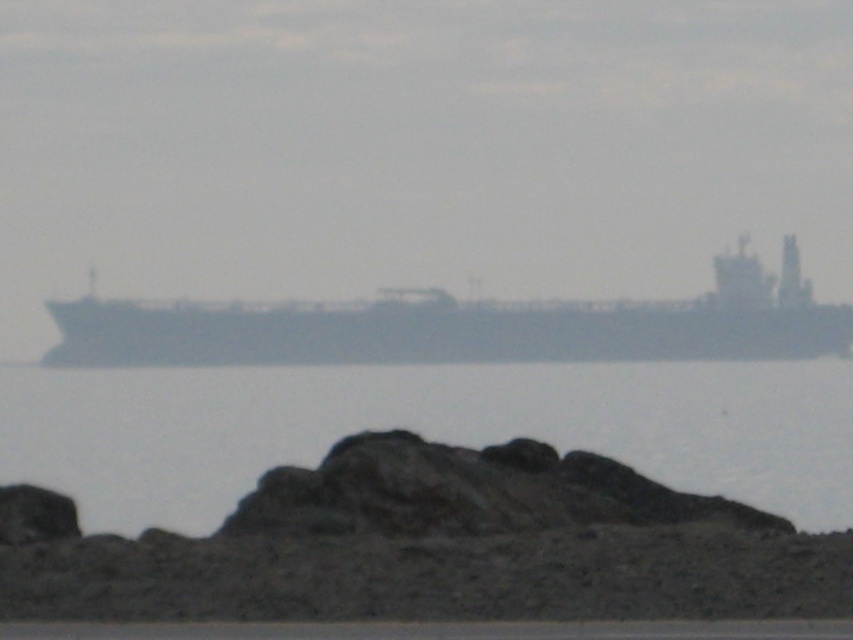
Between transparent water at center and gray matte ship at center, which one appears on the left side from the viewer's perspective?

transparent water at center is more to the left.

Which is behind, point (692, 406) or point (119, 340)?

Point (119, 340)

Does point (833, 440) come behind point (735, 304)?

No.

Locate an element on the screen. The image size is (853, 640). transparent water at center is located at coordinates (422, 428).